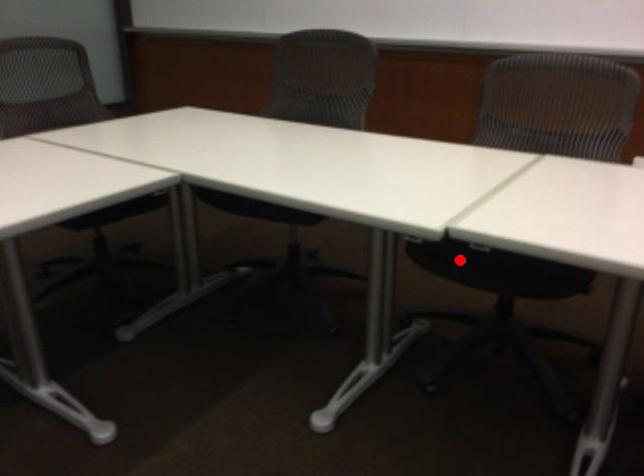
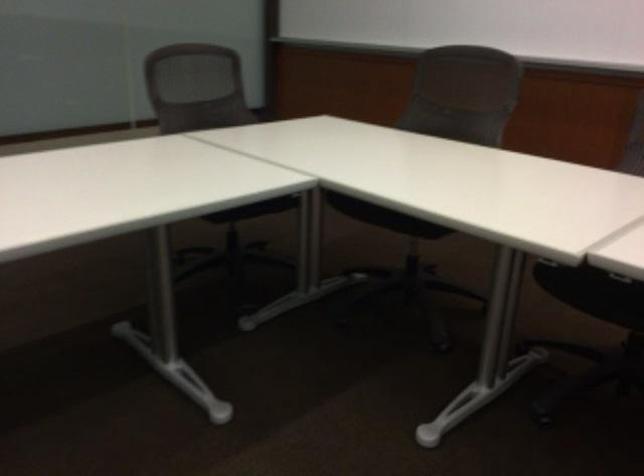
The point at the highlighted location is marked in the first image. Where is the corresponding point in the second image?

(592, 292)